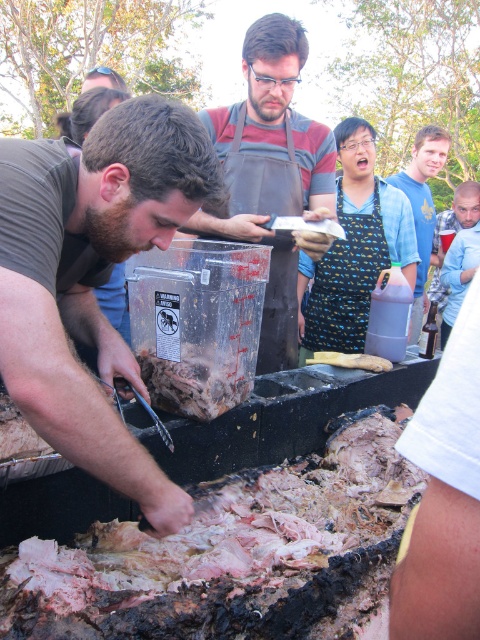
You are a photographer trying to capture a shot of the brown meat at center and the blue denim shirt at upper right. Based on their positions, which object is located to the left of the other?

The brown meat at center is positioned on the left side of blue denim shirt at upper right.

You are standing at the center of the scene and need to reach the matte black apron at center. Which direction should you move to find it?

The matte black apron at center is located at point coordinates, so you should move towards the center to find it.

You are standing in the outdoor cooking area and need to hand a tool to both the person wearing the matte black apron at center and the blue denim shirt at upper right. In what order should you approach them from your current position to give them the tool efficiently?

Since the matte black apron at center is to the left of the blue denim shirt at upper right, you should first approach the matte black apron at center and then the blue denim shirt at upper right to maintain a left to right path.